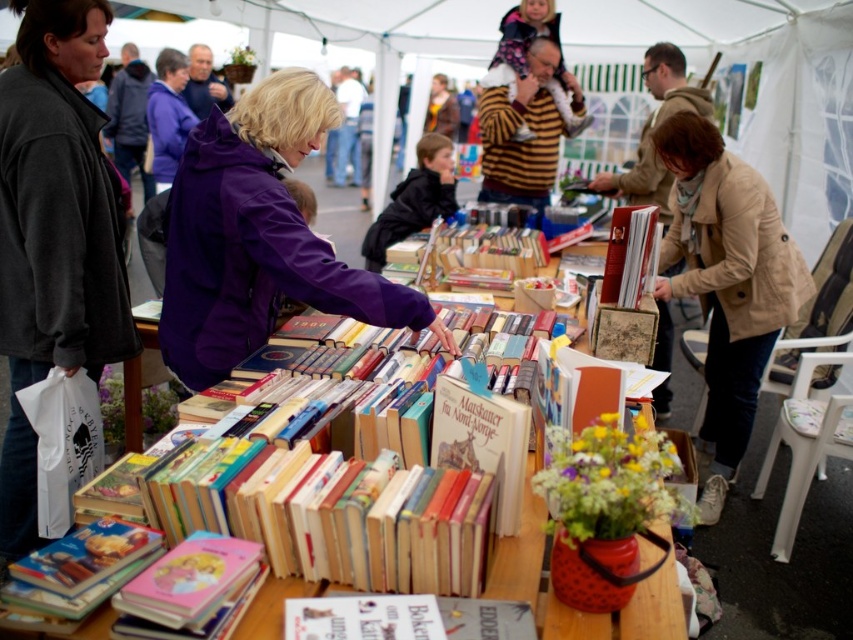
Between point (802, 275) and point (637, 292), which one is positioned in front?

Point (637, 292)

Describe the element at coordinates (726, 282) in the screenshot. The image size is (853, 640). I see `beige coat at lower right` at that location.

Is point (755, 177) closer to viewer compared to point (631, 212)?

No, (755, 177) is further to viewer.

Find the location of a particular element. beige coat at lower right is located at coordinates (726, 282).

Is point (670, 236) positioned before point (228, 536)?

No, (670, 236) is behind (228, 536).

Between beige coat at lower right and pink matte book at lower left, which one has more height?

→ beige coat at lower right

Image resolution: width=853 pixels, height=640 pixels. Describe the element at coordinates (726, 282) in the screenshot. I see `beige coat at lower right` at that location.

Locate an element on the screen. beige coat at lower right is located at coordinates (726, 282).

Can you confirm if pink matte book at lower left is positioned to the left of hardcover book at center?

Indeed, pink matte book at lower left is positioned on the left side of hardcover book at center.

Is pink matte book at lower left wider than hardcover book at center?

No.

Describe the element at coordinates (186, 588) in the screenshot. I see `pink matte book at lower left` at that location.

Locate an element on the screen. This screenshot has height=640, width=853. pink matte book at lower left is located at coordinates (186, 588).